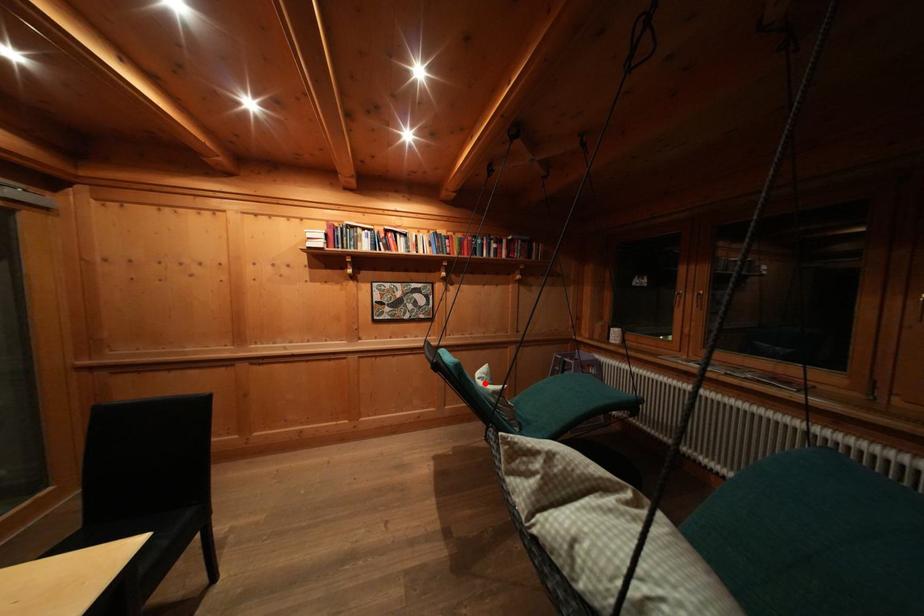
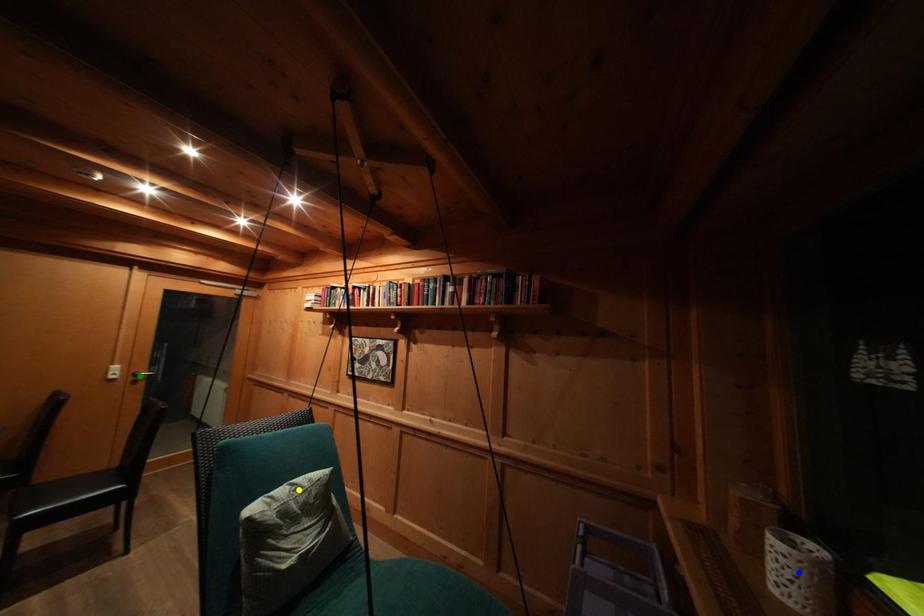
Question: I am providing you with two images of the same scene from different viewpoints. A red point is marked on the first image. You are given multiple points on the second image. Which mark in image 2 goes with the point in image 1?

Choices:
 (A) blue point
 (B) yellow point
 (C) green point

Answer: (B)